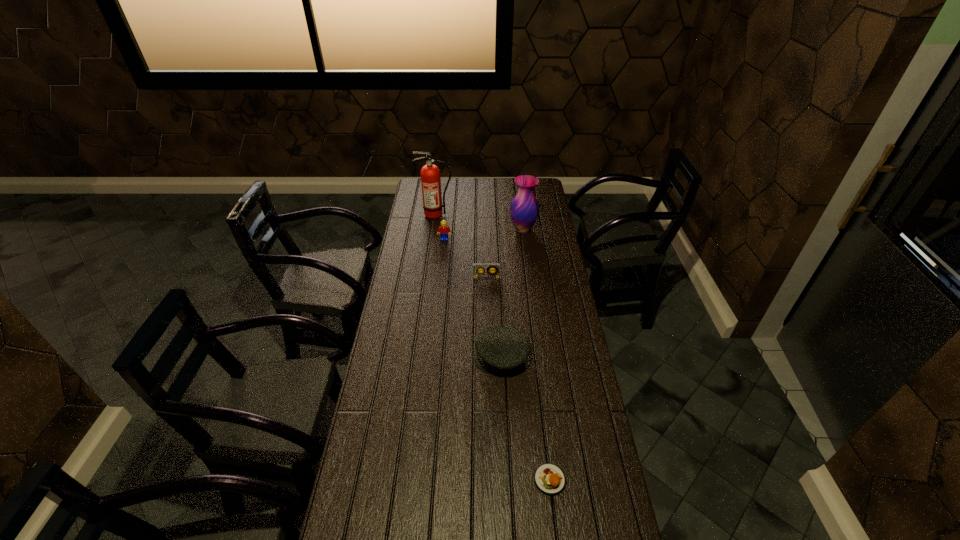
Locate an element on the screen. vacant area that lies between the fourth farthest object and the Lego is located at coordinates (466, 259).

Select which object appears as the second closest to the fifth tallest object. Please provide its 2D coordinates. Your answer should be formatted as a tuple, i.e. [(x, y)], where the tuple contains the x and y coordinates of a point satisfying the conditions above.

[(524, 210)]

You are a GUI agent. You are given a task and a screenshot of the screen. Output one action in this format:
    pyautogui.click(x=<x>, y=<y>)
    Task: Click on the object that stands as the fourth closest to the beret
    This screenshot has height=540, width=960.
    Given the screenshot: What is the action you would take?
    pyautogui.click(x=524, y=210)

This screenshot has width=960, height=540. Identify the location of free space that satisfies the following two spatial constraints: 1. at the front of the nearest object with visible reels; 2. on the left side of the second shortest object. (490, 480).

The height and width of the screenshot is (540, 960). I want to click on vacant space that satisfies the following two spatial constraints: 1. on the handle side of the farthest object; 2. on the right side of the second tallest object, so click(434, 230).

Find the location of `free space that satisfies the following two spatial constraints: 1. on the front-facing side of the beret; 2. on the left side of the nearest object`. free space that satisfies the following two spatial constraints: 1. on the front-facing side of the beret; 2. on the left side of the nearest object is located at coordinates (507, 480).

This screenshot has width=960, height=540. What are the coordinates of `vacant point that satisfies the following two spatial constraints: 1. on the front-facing side of the shortest object; 2. on the left side of the Lego` in the screenshot? It's located at (420, 480).